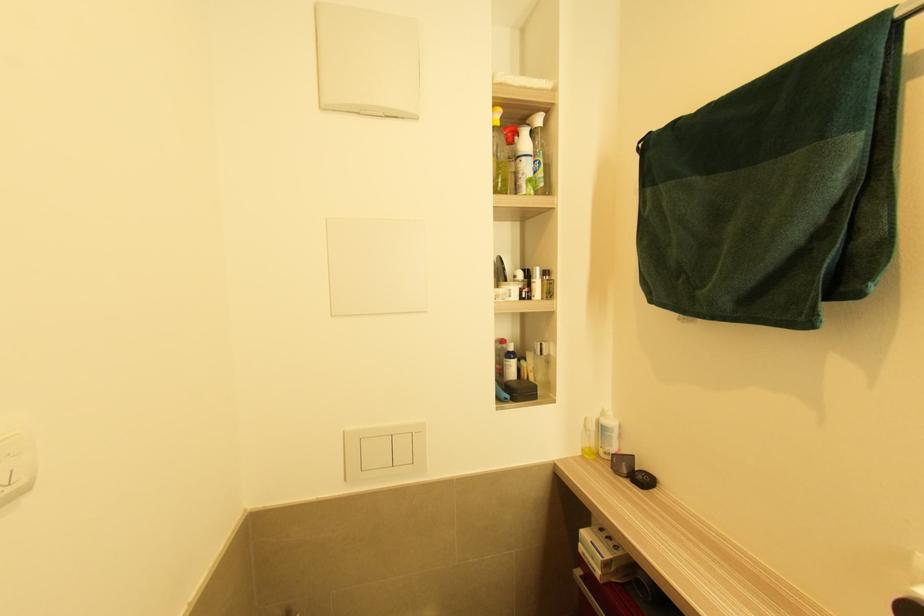
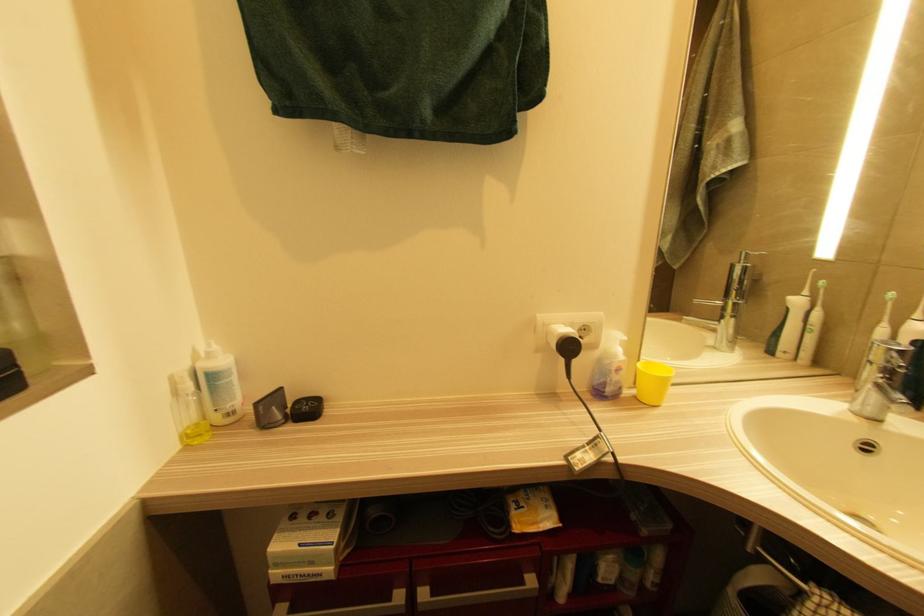
Question: How did the camera likely rotate?

Choices:
 (A) Left
 (B) Right
 (C) Up
 (D) Down

Answer: (B)